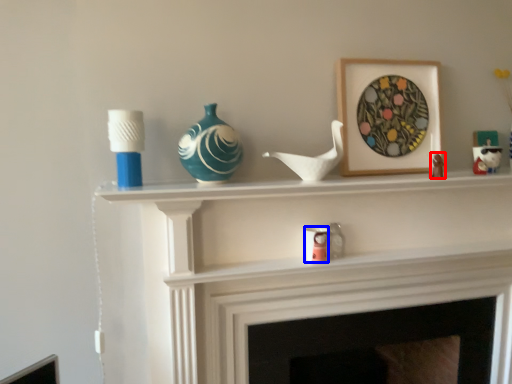
Question: Which object is further to the camera taking this photo, toy (highlighted by a red box) or candle holder (highlighted by a blue box)?

Choices:
 (A) toy
 (B) candle holder

Answer: (B)